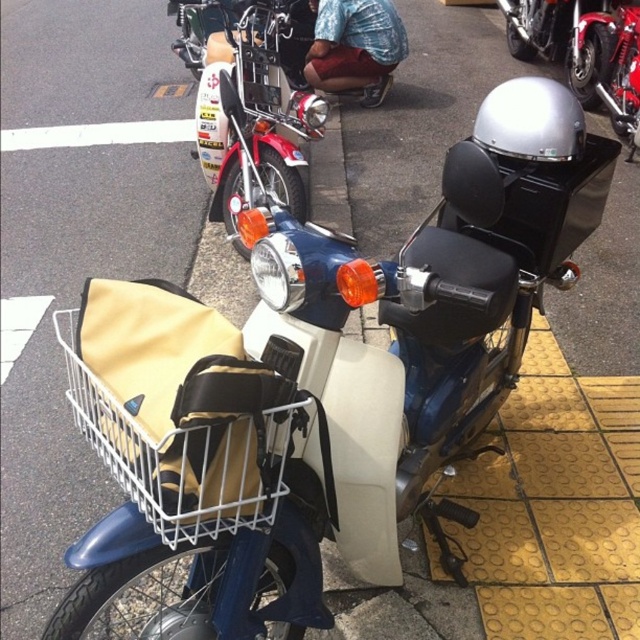
Question: Which object appears farthest from the camera in this image?

Choices:
 (A) shiny chrome helmet at upper right
 (B) beige fabric basket at center

Answer: (A)

Question: Among these objects, which one is farthest from the camera?

Choices:
 (A) shiny chrome handlebars at upper center
 (B) shiny chrome helmet at upper right
 (C) beige fabric basket at center

Answer: (B)

Question: Does shiny chrome handlebars at upper center have a smaller size compared to shiny chrome helmet at upper right?

Choices:
 (A) no
 (B) yes

Answer: (A)

Question: Estimate the real-world distances between objects in this image. Which object is farther from the shiny chrome helmet at upper right?

Choices:
 (A) beige fabric basket at center
 (B) shiny chrome handlebars at upper center

Answer: (A)

Question: Is shiny chrome handlebars at upper center thinner than beige fabric basket at center?

Choices:
 (A) yes
 (B) no

Answer: (B)

Question: Does shiny chrome handlebars at upper center appear under beige fabric basket at center?

Choices:
 (A) yes
 (B) no

Answer: (B)